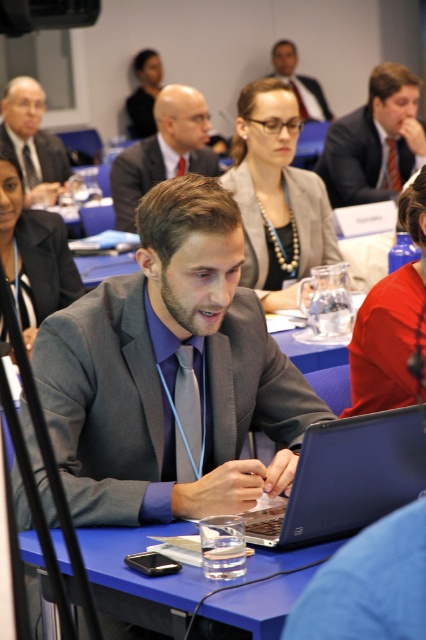
You are a photographer taking a portrait of the man at the blue table. You need to ensure that both the matte black laptop at center and the orange striped tie at center are visible in the frame. Based on their positions, which object should you position closer to the left side of the camera to include both in the photo?

The matte black laptop at center is to the left of the orange striped tie at center. To include both in the photo, position the matte black laptop at center closer to the left side of the camera so that the orange striped tie at center remains within the frame on the right side.

You are a photographer trying to capture a candid shot of the man at the blue table without him noticing. You have a camera with a zoom lens. The camera can focus on objects within a 0.15 unit radius from the center of the zoom. If you center your zoom at point (34, 141), will the matte black suit at upper left be within the focus range?

The matte black suit at upper left is located exactly at point (34, 141), so it will be within the focus range of the camera since the center of the zoom is precisely on that point.

You are organizing a charity event and need to seat attendees based on their clothing sizes. You have two guests wearing gray matte suits. One is wearing the gray matte suit at center, and the other is wearing the matte gray suit at upper right. Which guest should you seat at the larger table to accommodate their suit size?

The gray matte suit at center is bigger than the matte gray suit at upper right, so the guest wearing the gray matte suit at center should be seated at the larger table to accommodate their suit size.